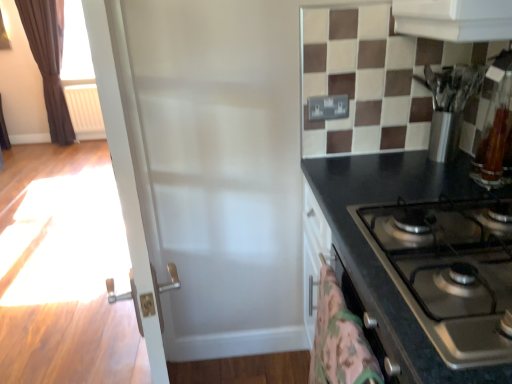
The image size is (512, 384). Identify the location of vacant space situated above white plastic radiator at left (from a real-world perspective). (76, 88).